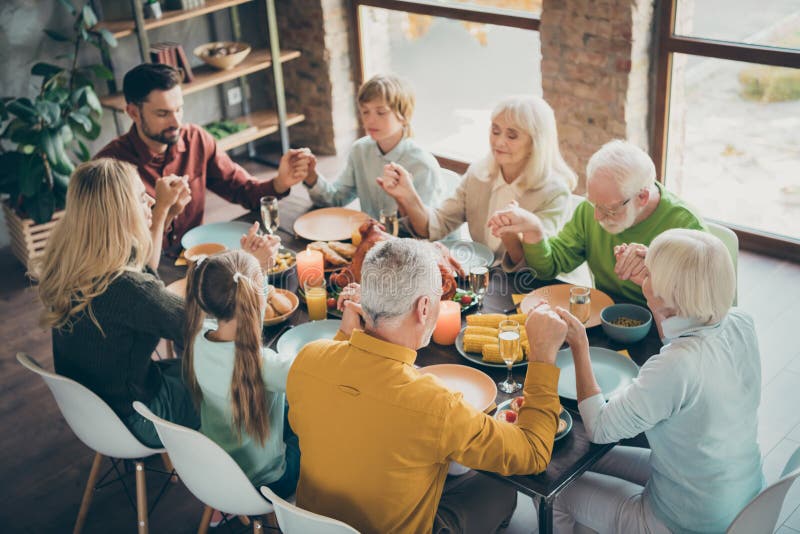
You are a GUI agent. You are given a task and a screenshot of the screen. Output one action in this format:
    pyautogui.click(x=<x>, y=<y>)
    Task: Click on the plates
    Image resolution: width=800 pixels, height=534 pixels.
    Given the screenshot: What is the action you would take?
    pyautogui.click(x=480, y=365), pyautogui.click(x=476, y=380), pyautogui.click(x=566, y=387), pyautogui.click(x=566, y=424), pyautogui.click(x=600, y=321), pyautogui.click(x=482, y=254), pyautogui.click(x=306, y=334), pyautogui.click(x=290, y=302), pyautogui.click(x=222, y=230), pyautogui.click(x=326, y=226)